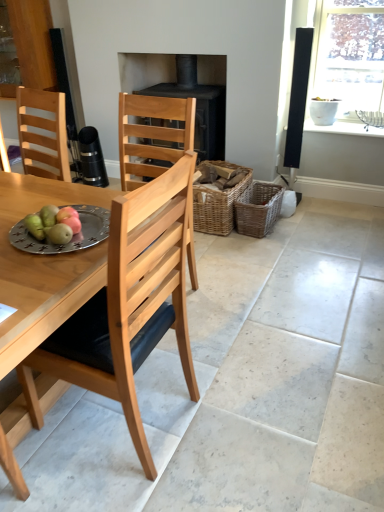
Question: Does woven brown basket at center-right, arranged as the second basket when viewed from the left, appear on the right side of silver metallic plate at table left?

Choices:
 (A) no
 (B) yes

Answer: (B)

Question: Is woven brown basket at center-right, arranged as the second basket when viewed from the left, located outside silver metallic plate at table left?

Choices:
 (A) no
 (B) yes

Answer: (B)

Question: From the image's perspective, is woven brown basket at center-right, acting as the 1th basket starting from the right, on top of silver metallic plate at table left?

Choices:
 (A) no
 (B) yes

Answer: (B)

Question: Is woven brown basket at center-right, acting as the 1th basket starting from the right, at the left side of silver metallic plate at table left?

Choices:
 (A) no
 (B) yes

Answer: (A)

Question: Is woven brown basket at center-right, acting as the 1th basket starting from the right, behind silver metallic plate at table left?

Choices:
 (A) yes
 (B) no

Answer: (A)

Question: Does woven brown basket at center-right, arranged as the second basket when viewed from the left, contain silver metallic plate at table left?

Choices:
 (A) yes
 (B) no

Answer: (B)

Question: Considering the relative sizes of silver metallic plate at table left and green matte pears at table left in the image provided, is silver metallic plate at table left thinner than green matte pears at table left?

Choices:
 (A) yes
 (B) no

Answer: (B)

Question: From the image's perspective, is silver metallic plate at table left located beneath green matte pears at table left?

Choices:
 (A) yes
 (B) no

Answer: (A)

Question: Is silver metallic plate at table left at the left side of green matte pears at table left?

Choices:
 (A) yes
 (B) no

Answer: (B)

Question: From a real-world perspective, is silver metallic plate at table left physically above green matte pears at table left?

Choices:
 (A) no
 (B) yes

Answer: (A)

Question: Can you see silver metallic plate at table left touching green matte pears at table left?

Choices:
 (A) no
 (B) yes

Answer: (A)

Question: Is silver metallic plate at table left positioned before green matte pears at table left?

Choices:
 (A) no
 (B) yes

Answer: (B)

Question: Considering the relative sizes of black matte fireplace at center and natural wood chair at center in the image provided, is black matte fireplace at center shorter than natural wood chair at center?

Choices:
 (A) yes
 (B) no

Answer: (A)